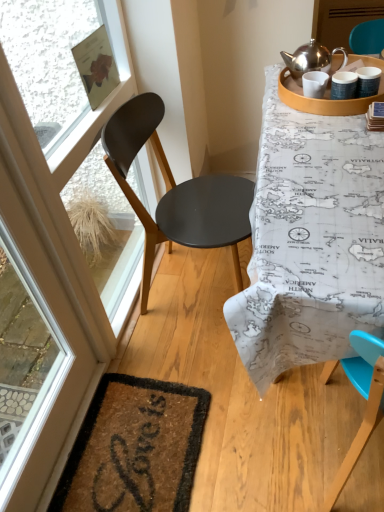
Where is `free space to the right of brown coir mat at lower left`? This screenshot has height=512, width=384. free space to the right of brown coir mat at lower left is located at coordinates (252, 433).